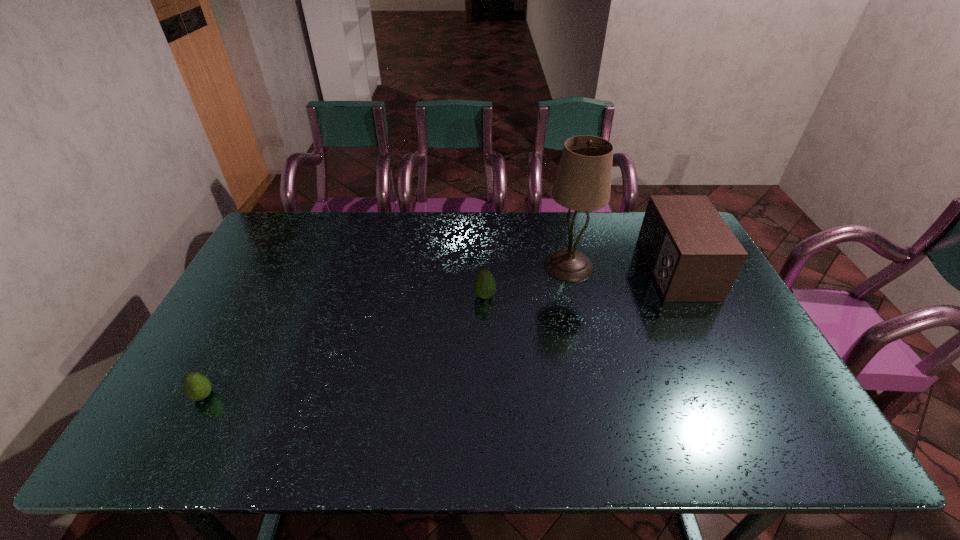
I want to click on empty location between the farther avocado and the second object from right to left, so (x=527, y=281).

Locate an element on the screen. empty location between the right avocado and the third object from left to right is located at coordinates (527, 281).

The image size is (960, 540). I want to click on free space between the right avocado and the nearest object, so click(344, 346).

I want to click on free space between the rightmost object and the second object from left to right, so click(x=580, y=282).

Locate an element on the screen. free space between the second object from right to left and the shortest object is located at coordinates (386, 331).

The width and height of the screenshot is (960, 540). I want to click on object that is the second closest one to the farther avocado, so click(x=693, y=255).

Choose which object is the nearest neighbor to the rightmost object. Please provide its 2D coordinates. Your answer should be formatted as a tuple, i.e. [(x, y)], where the tuple contains the x and y coordinates of a point satisfying the conditions above.

[(583, 181)]